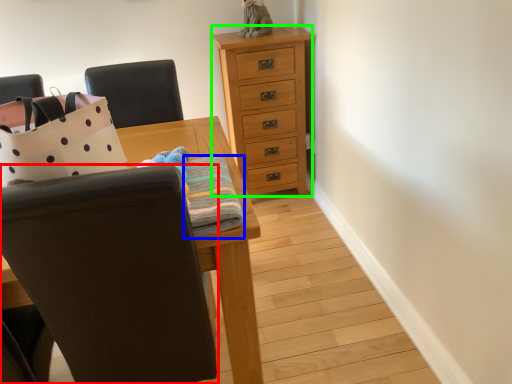
Question: Which object is the farthest from chair (highlighted by a red box)? Choose among these: blanket (highlighted by a blue box) or chest of drawers (highlighted by a green box).

Choices:
 (A) blanket
 (B) chest of drawers

Answer: (B)